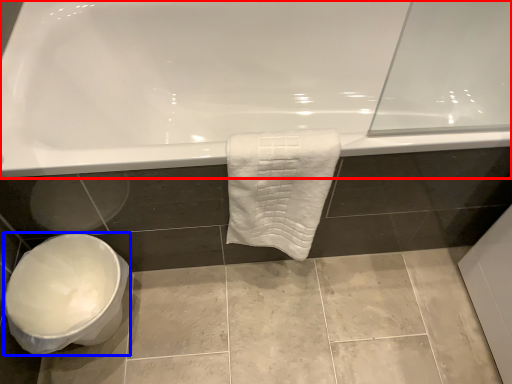
Question: Which of the following is the closest to the observer, bathtub (highlighted by a red box) or toilet bowl (highlighted by a blue box)?

Choices:
 (A) bathtub
 (B) toilet bowl

Answer: (A)